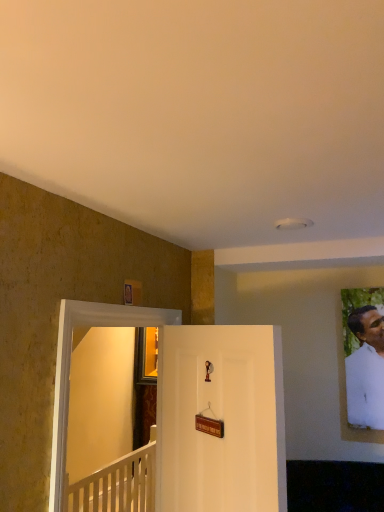
Question: Relative to white wooden railing at lower left, is white matte portrait at right in front or behind?

Choices:
 (A) front
 (B) behind

Answer: (A)

Question: Do you think white matte portrait at right is within white wooden railing at lower left, or outside of it?

Choices:
 (A) outside
 (B) inside

Answer: (A)

Question: Estimate the real-world distances between objects in this image. Which object is closer to the white wooden railing at lower left?

Choices:
 (A) white matte portrait at right
 (B) transparent glass door at left
 (C) white matte door at center

Answer: (C)

Question: Which of these objects is positioned farthest from the white wooden railing at lower left?

Choices:
 (A) white matte door at center
 (B) white matte portrait at right
 (C) transparent glass door at left

Answer: (B)